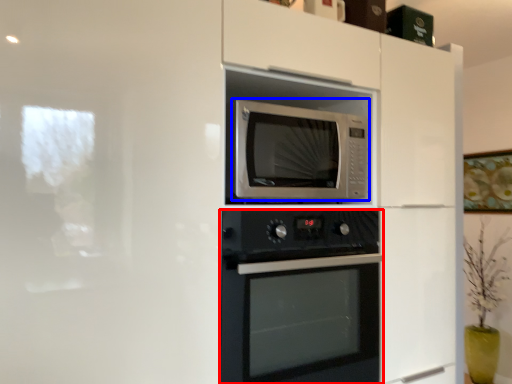
Question: Which object is closer to the camera taking this photo, oven (highlighted by a red box) or microwave oven (highlighted by a blue box)?

Choices:
 (A) oven
 (B) microwave oven

Answer: (A)